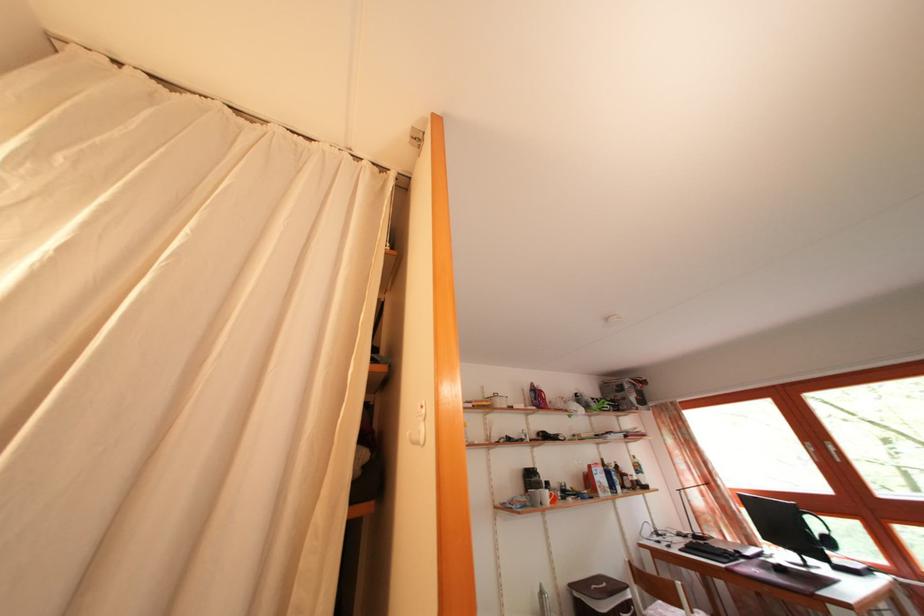
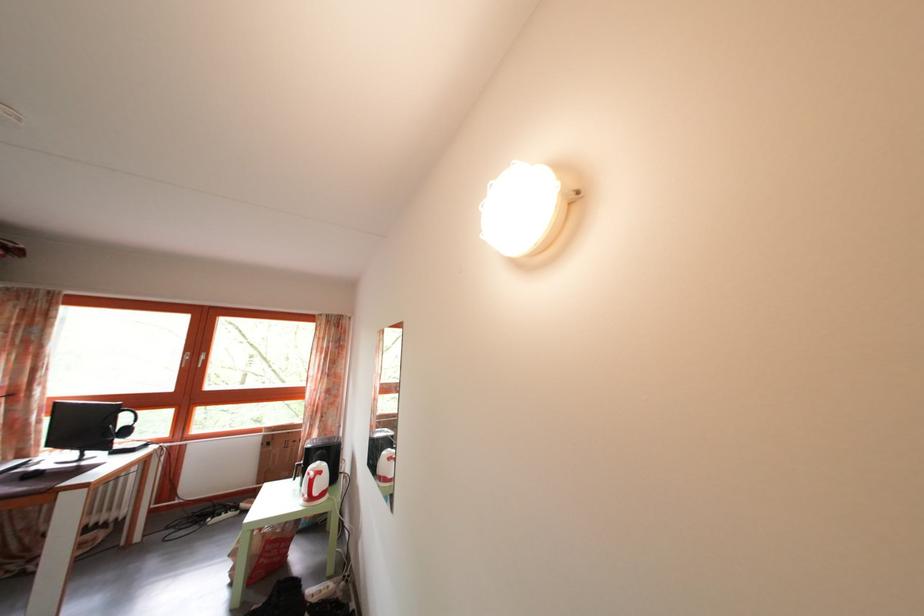
In the second image, find the point that corresponds to (823,455) in the first image.

(199, 363)